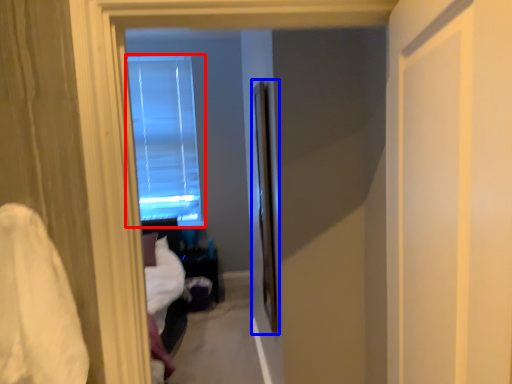
Question: Among these objects, which one is farthest to the camera, window (highlighted by a red box) or screen door (highlighted by a blue box)?

Choices:
 (A) window
 (B) screen door

Answer: (A)